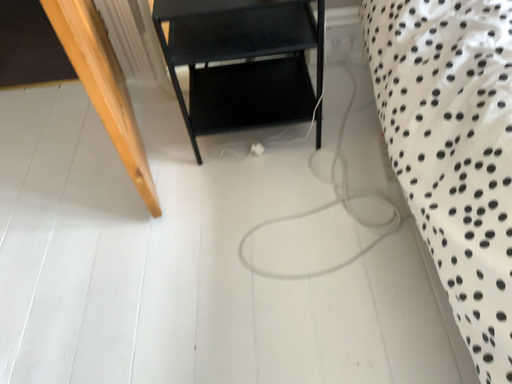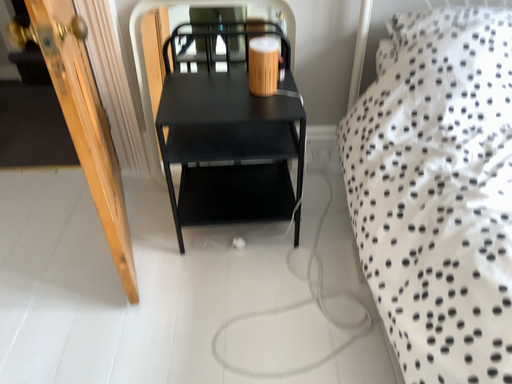
Question: Which way did the camera rotate in the video?

Choices:
 (A) rotated downward
 (B) rotated upward

Answer: (B)